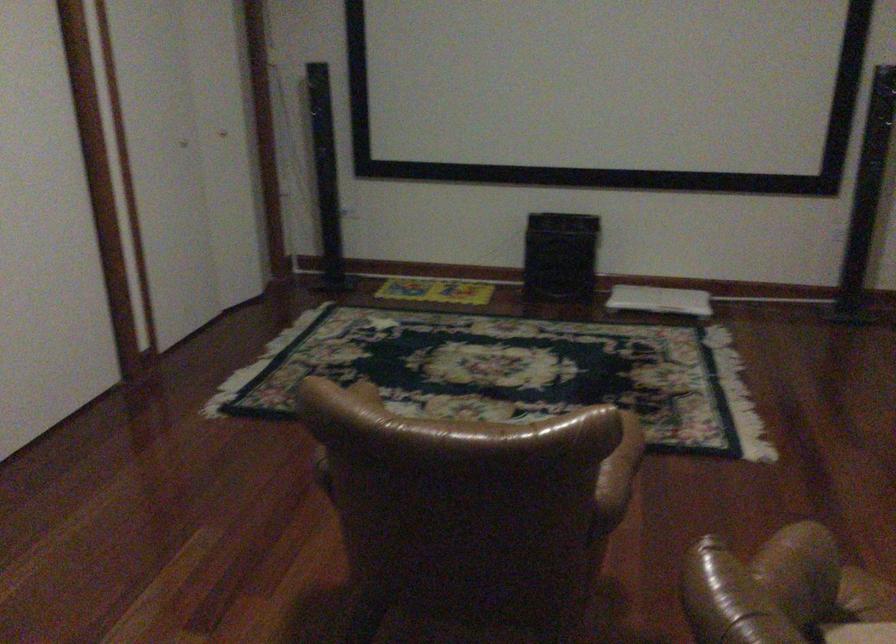
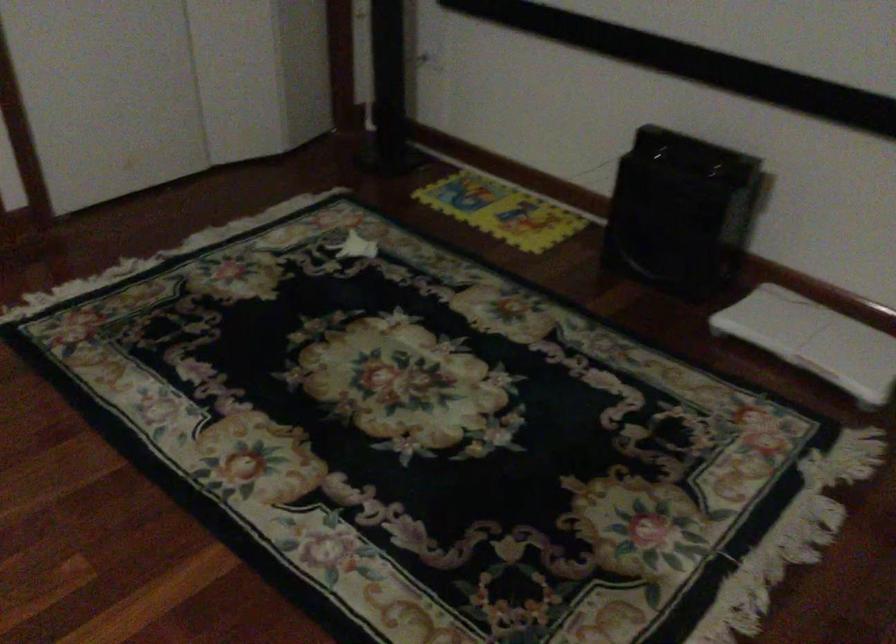
Locate, in the second image, the point that corresponds to (x=666, y=292) in the first image.

(814, 339)